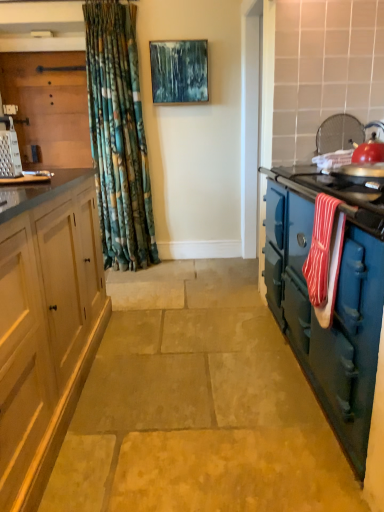
Question: Can you confirm if red striped towel at right is positioned to the right of brushed metal grater at left, placed as the second cabinetry when sorted from bottom to top?

Choices:
 (A) yes
 (B) no

Answer: (A)

Question: Is red striped towel at right bigger than brushed metal grater at left, which is counted as the 2th cabinetry, starting from the front?

Choices:
 (A) yes
 (B) no

Answer: (B)

Question: Is red striped towel at right smaller than brushed metal grater at left, placed as the 1th cabinetry when sorted from top to bottom?

Choices:
 (A) yes
 (B) no

Answer: (A)

Question: Is the position of red striped towel at right less distant than that of brushed metal grater at left, placed as the 1th cabinetry when sorted from top to bottom?

Choices:
 (A) yes
 (B) no

Answer: (A)

Question: Considering the relative sizes of red striped towel at right and brushed metal grater at left, which ranks as the second cabinetry in right-to-left order, in the image provided, is red striped towel at right wider than brushed metal grater at left, which ranks as the second cabinetry in right-to-left order,?

Choices:
 (A) no
 (B) yes

Answer: (A)

Question: Is point (168, 41) positioned closer to the camera than point (11, 130)?

Choices:
 (A) farther
 (B) closer

Answer: (A)

Question: Considering their positions, is textured canvas painting at upper center located in front of or behind metallic silver grater at left?

Choices:
 (A) behind
 (B) front

Answer: (A)

Question: From a real-world perspective, is textured canvas painting at upper center above or below metallic silver grater at left?

Choices:
 (A) below
 (B) above

Answer: (B)

Question: Considering the positions of textured canvas painting at upper center and metallic silver grater at left in the image, is textured canvas painting at upper center wider or thinner than metallic silver grater at left?

Choices:
 (A) wide
 (B) thin

Answer: (B)

Question: Relative to natural stone floor at center, is brushed metal grater at left, arranged as the 1th cabinetry when viewed from the back, in front or behind?

Choices:
 (A) front
 (B) behind

Answer: (B)

Question: In the image, is brushed metal grater at left, placed as the second cabinetry when sorted from bottom to top, on the left side or the right side of natural stone floor at center?

Choices:
 (A) right
 (B) left

Answer: (B)

Question: From the image's perspective, relative to natural stone floor at center, is brushed metal grater at left, which ranks as the second cabinetry in right-to-left order, above or below?

Choices:
 (A) above
 (B) below

Answer: (A)

Question: Looking at the image, does brushed metal grater at left, placed as the 1th cabinetry when sorted from top to bottom, seem bigger or smaller compared to natural stone floor at center?

Choices:
 (A) big
 (B) small

Answer: (B)

Question: Considering the positions of blue cast iron stove at right, the second cabinetry positioned from the top, and red striped towel at right in the image, is blue cast iron stove at right, the second cabinetry positioned from the top, taller or shorter than red striped towel at right?

Choices:
 (A) tall
 (B) short

Answer: (A)

Question: From a real-world perspective, is blue cast iron stove at right, which is the second cabinetry in back-to-front order, physically located above or below red striped towel at right?

Choices:
 (A) above
 (B) below

Answer: (B)